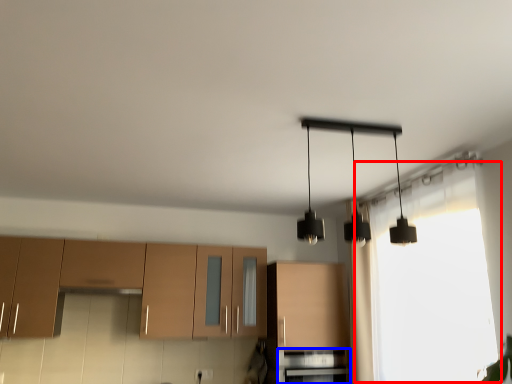
Question: Which of the following is the farthest to the observer, window (highlighted by a red box) or oven (highlighted by a blue box)?

Choices:
 (A) window
 (B) oven

Answer: (B)